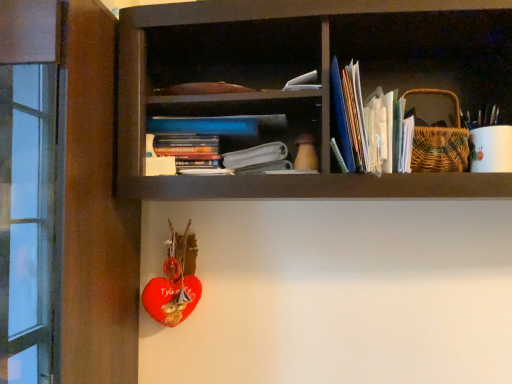
Locate an element on the screen. The width and height of the screenshot is (512, 384). white paper stack at upper right, placed as the second book when sorted from left to right is located at coordinates (370, 124).

Image resolution: width=512 pixels, height=384 pixels. What do you see at coordinates (370, 124) in the screenshot?
I see `white paper stack at upper right, the first book viewed from the right` at bounding box center [370, 124].

Describe the element at coordinates (183, 151) in the screenshot. I see `hardcover book at center, which is counted as the 2th book, starting from the right` at that location.

At what (x,y) coordinates should I click in order to perform the action: click on white paper stack at upper right, placed as the second book when sorted from left to right. Please return your answer as a coordinate pair (x, y). Image resolution: width=512 pixels, height=384 pixels. Looking at the image, I should click on (370, 124).

Is woven brown basket at upper right in front of or behind white paper at center in the image?

woven brown basket at upper right is in front of white paper at center.

Between woven brown basket at upper right and white paper at center, which one has smaller width?

white paper at center.

Considering the points (438, 154) and (228, 152), which point is in front, point (438, 154) or point (228, 152)?

The point (438, 154) is in front.

Considering the positions of objects woven brown basket at upper right and white paper at center in the image provided, who is more to the left, woven brown basket at upper right or white paper at center?

white paper at center.

Which of these two, white paper stack at upper right, the first book viewed from the right, or woven brown basket at upper right, stands shorter?

white paper stack at upper right, the first book viewed from the right.

Image resolution: width=512 pixels, height=384 pixels. Find the location of `basket that is behind the white paper stack at upper right, placed as the second book when sorted from left to right`. basket that is behind the white paper stack at upper right, placed as the second book when sorted from left to right is located at coordinates (440, 141).

Is white paper stack at upper right, the first book viewed from the right, positioned beyond the bounds of woven brown basket at upper right?

That's correct, white paper stack at upper right, the first book viewed from the right, is outside of woven brown basket at upper right.

Considering the points (366, 104) and (151, 139), which point is behind, point (366, 104) or point (151, 139)?

The point (151, 139) is farther from the camera.

Considering the relative positions of white paper stack at upper right, the first book viewed from the right, and hardcover book at center, the first book in the left-to-right sequence, in the image provided, is white paper stack at upper right, the first book viewed from the right, to the right of hardcover book at center, the first book in the left-to-right sequence, from the viewer's perspective?

Indeed, white paper stack at upper right, the first book viewed from the right, is positioned on the right side of hardcover book at center, the first book in the left-to-right sequence.

Could you tell me if white paper stack at upper right, placed as the second book when sorted from left to right, is turned towards hardcover book at center, the first book in the left-to-right sequence?

No, white paper stack at upper right, placed as the second book when sorted from left to right, is not aimed at hardcover book at center, the first book in the left-to-right sequence.

Between woven brown basket at upper right and hardcover book at center, the first book in the left-to-right sequence, which one has less height?

With less height is hardcover book at center, the first book in the left-to-right sequence.

Are woven brown basket at upper right and hardcover book at center, which is counted as the 2th book, starting from the right, far apart?

No, woven brown basket at upper right is not far from hardcover book at center, which is counted as the 2th book, starting from the right.

Image resolution: width=512 pixels, height=384 pixels. What are the coordinates of `basket in front of the hardcover book at center, the first book in the left-to-right sequence` in the screenshot? It's located at (440, 141).

Can you confirm if hardcover book at center, the first book in the left-to-right sequence, is bigger than white paper stack at upper right, placed as the second book when sorted from left to right?

Incorrect, hardcover book at center, the first book in the left-to-right sequence, is not larger than white paper stack at upper right, placed as the second book when sorted from left to right.

From a real-world perspective, between hardcover book at center, the first book in the left-to-right sequence, and white paper stack at upper right, the first book viewed from the right, who is vertically lower?

hardcover book at center, the first book in the left-to-right sequence.

Choose the correct answer: Is hardcover book at center, which is counted as the 2th book, starting from the right, inside white paper stack at upper right, the first book viewed from the right, or outside it?

hardcover book at center, which is counted as the 2th book, starting from the right, is spatially situated outside white paper stack at upper right, the first book viewed from the right.

Which point is more forward, [161,152] or [333,75]?

Positioned in front is point [333,75].

Is woven brown basket at upper right oriented towards white paper stack at upper right, placed as the second book when sorted from left to right?

No.

Can you confirm if woven brown basket at upper right is positioned to the right of white paper stack at upper right, placed as the second book when sorted from left to right?

Yes, woven brown basket at upper right is to the right of white paper stack at upper right, placed as the second book when sorted from left to right.

From a real-world perspective, is woven brown basket at upper right over white paper stack at upper right, placed as the second book when sorted from left to right?

Correct, in the physical world, woven brown basket at upper right is higher than white paper stack at upper right, placed as the second book when sorted from left to right.

Is woven brown basket at upper right wider or thinner than white paper stack at upper right, placed as the second book when sorted from left to right?

Clearly, woven brown basket at upper right has less width compared to white paper stack at upper right, placed as the second book when sorted from left to right.

Is hardcover book at center, which is counted as the 2th book, starting from the right, placed right next to woven brown basket at upper right?

hardcover book at center, which is counted as the 2th book, starting from the right, and woven brown basket at upper right are clearly separated.

Considering their positions, is hardcover book at center, which is counted as the 2th book, starting from the right, located in front of or behind woven brown basket at upper right?

In the image, hardcover book at center, which is counted as the 2th book, starting from the right, appears behind woven brown basket at upper right.

Is hardcover book at center, the first book in the left-to-right sequence, looking in the opposite direction of woven brown basket at upper right?

hardcover book at center, the first book in the left-to-right sequence, does not have its back to woven brown basket at upper right.

Between point (191, 155) and point (434, 94), which one is positioned behind?

The point (434, 94) is more distant.

In order to click on basket above the white paper at center (from a real-world perspective) in this screenshot , I will do `click(440, 141)`.

Where is `basket above the white paper stack at upper right, the first book viewed from the right (from the image's perspective)`? Image resolution: width=512 pixels, height=384 pixels. basket above the white paper stack at upper right, the first book viewed from the right (from the image's perspective) is located at coordinates (440, 141).

Looking at the image, which one is located closer to white paper at center, white paper stack at upper right, placed as the second book when sorted from left to right, or woven brown basket at upper right?

white paper stack at upper right, placed as the second book when sorted from left to right, is positioned closer to the anchor white paper at center.

From the image, which object appears to be farther from white paper stack at upper right, the first book viewed from the right, woven brown basket at upper right or white paper at center?

white paper at center is positioned further to the anchor white paper stack at upper right, the first book viewed from the right.

From the picture: Considering their positions, is woven brown basket at upper right positioned closer to white paper at center than hardcover book at center, the first book in the left-to-right sequence?

Based on the image, hardcover book at center, the first book in the left-to-right sequence, appears to be nearer to white paper at center.

Based on their spatial positions, is white paper stack at upper right, the first book viewed from the right, or white paper at center further from hardcover book at center, the first book in the left-to-right sequence?

white paper stack at upper right, the first book viewed from the right, is further to hardcover book at center, the first book in the left-to-right sequence.

Based on the photo, which object lies nearer to the anchor point woven brown basket at upper right, white paper stack at upper right, placed as the second book when sorted from left to right, or hardcover book at center, which is counted as the 2th book, starting from the right?

Among the two, white paper stack at upper right, placed as the second book when sorted from left to right, is located nearer to woven brown basket at upper right.

Based on their spatial positions, is woven brown basket at upper right or hardcover book at center, which is counted as the 2th book, starting from the right, further from white paper stack at upper right, the first book viewed from the right?

The object further to white paper stack at upper right, the first book viewed from the right, is hardcover book at center, which is counted as the 2th book, starting from the right.

When comparing their distances from woven brown basket at upper right, does white paper at center or white paper stack at upper right, placed as the second book when sorted from left to right, seem further?

Among the two, white paper at center is located further to woven brown basket at upper right.

When comparing their distances from white paper at center, does white paper stack at upper right, placed as the second book when sorted from left to right, or hardcover book at center, which is counted as the 2th book, starting from the right, seem further?

Among the two, white paper stack at upper right, placed as the second book when sorted from left to right, is located further to white paper at center.

Where is `paperback book between hardcover book at center, the first book in the left-to-right sequence, and woven brown basket at upper right, in the horizontal direction`? The image size is (512, 384). paperback book between hardcover book at center, the first book in the left-to-right sequence, and woven brown basket at upper right, in the horizontal direction is located at coordinates (255, 155).

Where is `book between hardcover book at center, the first book in the left-to-right sequence, and woven brown basket at upper right, in the horizontal direction`? book between hardcover book at center, the first book in the left-to-right sequence, and woven brown basket at upper right, in the horizontal direction is located at coordinates (370, 124).

Where is `book situated between white paper at center and woven brown basket at upper right from left to right`? The image size is (512, 384). book situated between white paper at center and woven brown basket at upper right from left to right is located at coordinates (370, 124).

This screenshot has width=512, height=384. I want to click on paperback book between hardcover book at center, which is counted as the 2th book, starting from the right, and white paper stack at upper right, the first book viewed from the right, in the horizontal direction, so click(x=255, y=155).